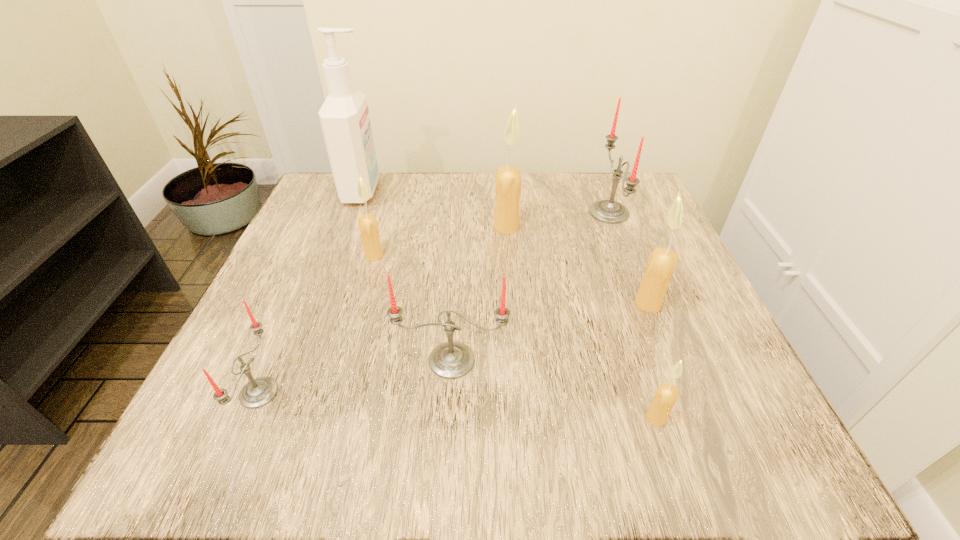
Image resolution: width=960 pixels, height=540 pixels. I want to click on free location located 0.120m on the right of the third object from left to right, so click(x=444, y=255).

Locate an element on the screen. free space located 0.120m on the front-facing side of the second red candle from left to right is located at coordinates (446, 457).

At what (x,y) coordinates should I click in order to perform the action: click on blank area located on the left of the nearest cream candle. Please return your answer as a coordinate pair (x, y). Looking at the image, I should click on (359, 418).

I want to click on vacant region located 0.240m on the front-facing side of the leftmost candle, so click(x=442, y=393).

Identify the location of cleansing agent that is at the far edge. This screenshot has width=960, height=540. (344, 116).

Identify the location of cleansing agent located at the left edge. (344, 116).

Where is `candle present at the left edge`? This screenshot has height=540, width=960. candle present at the left edge is located at coordinates (258, 392).

The image size is (960, 540). I want to click on object present at the far left corner, so click(x=344, y=116).

Find the location of a particular element. object at the near left corner is located at coordinates (258, 392).

What are the coordinates of `object located at the far right corner` in the screenshot? It's located at (607, 211).